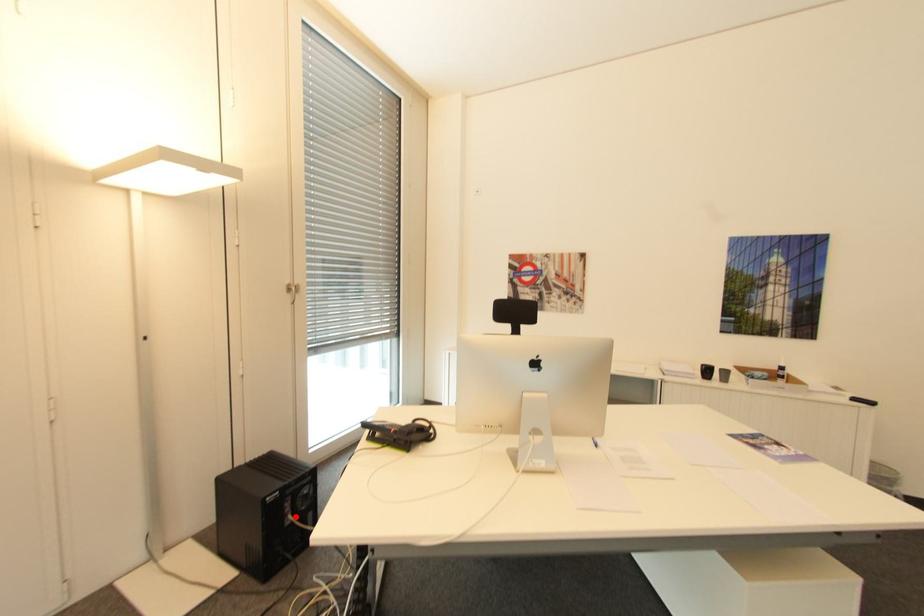
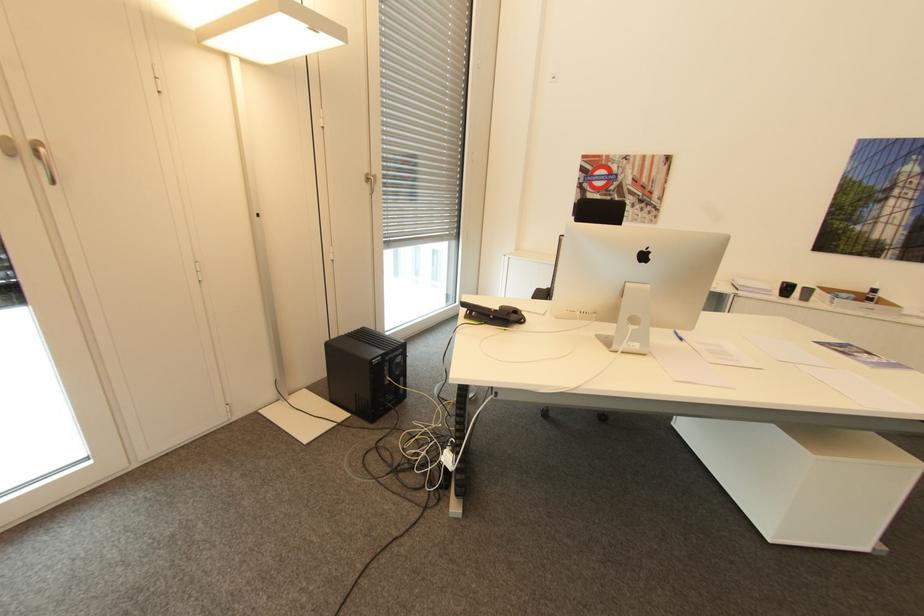
Find the pixel in the second image that matches the highlighted location in the first image.

(394, 379)